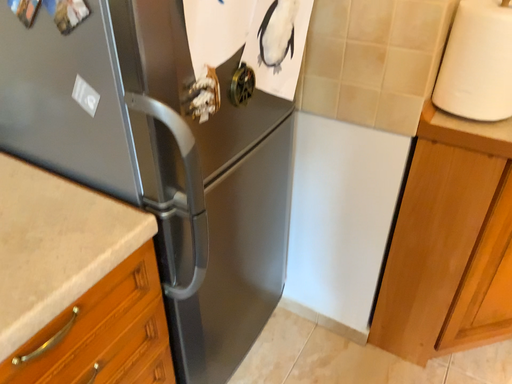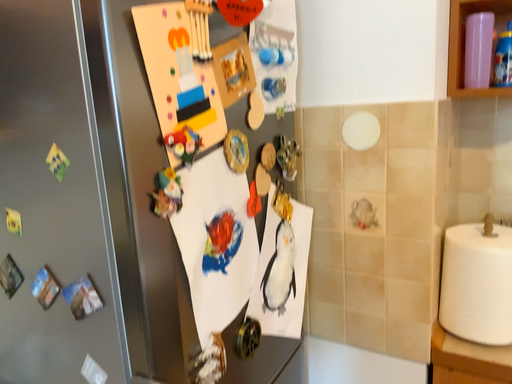
Question: Which way did the camera rotate in the video?

Choices:
 (A) rotated downward
 (B) rotated upward

Answer: (B)